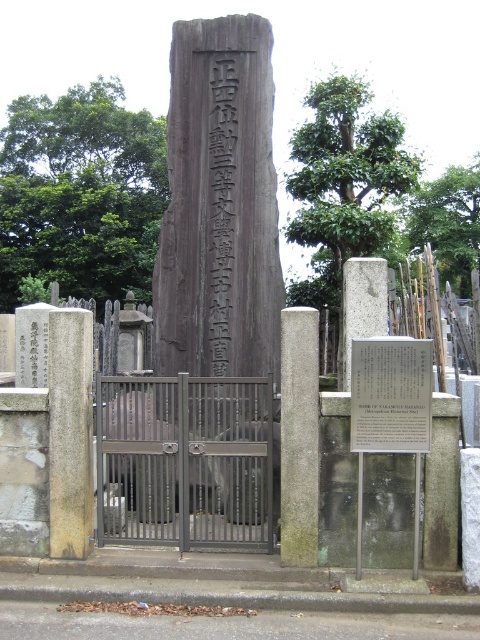
You are visiting a historical site and see the metallic gate at center and the gray stone marker at center. Which object is positioned lower in the scene?

The metallic gate at center is located below the gray stone marker at center, so the metallic gate at center is positioned lower in the scene.

You are visiting the cemetery and want to take a photo of the gray stone pillar at left and the metallic plaque at center. Which object should you focus on first if you want to capture both in one frame without moving your camera?

The gray stone pillar at left is much taller than the metallic plaque at center, so you should focus on the gray stone pillar at left first to ensure it fits properly in the frame.